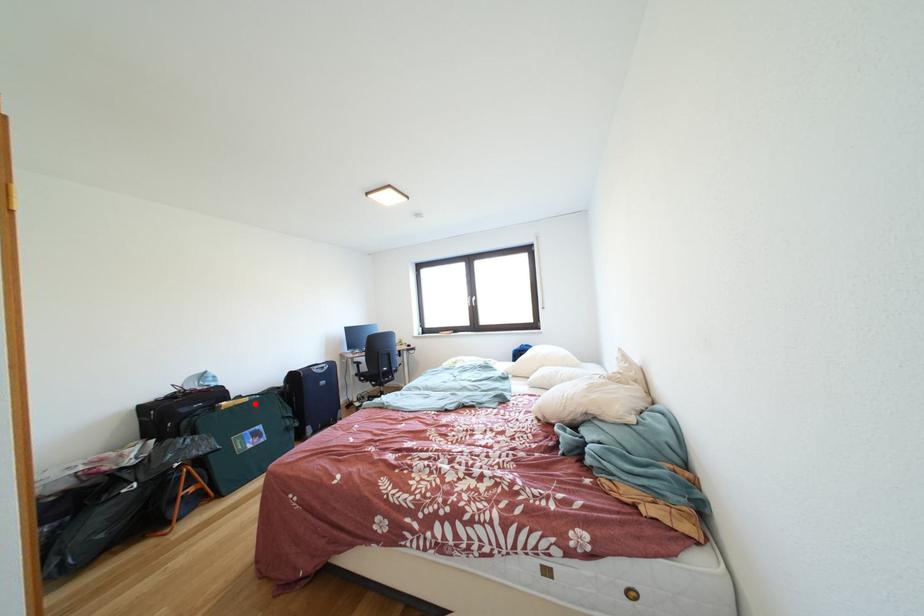
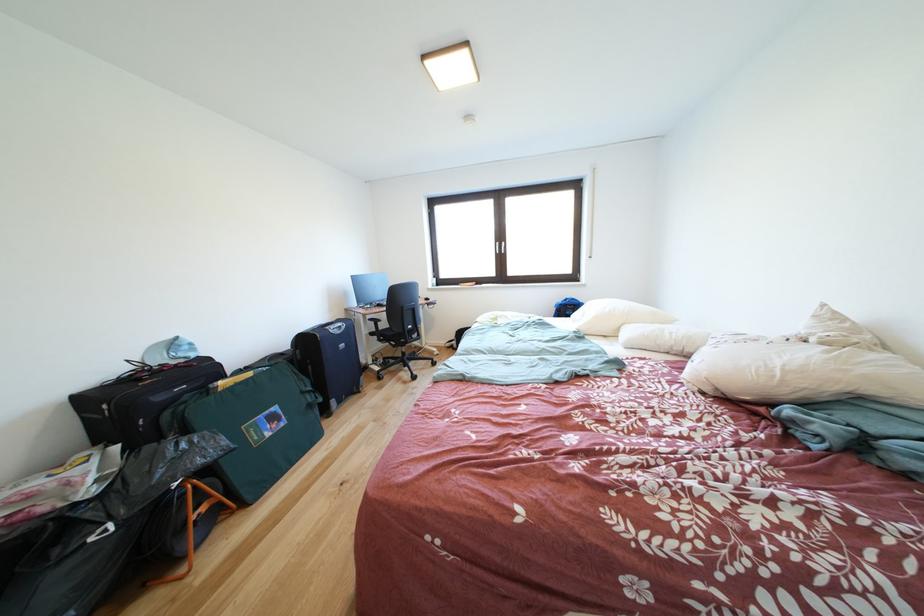
The point at the highlighted location is marked in the first image. Where is the corresponding point in the second image?

(259, 379)